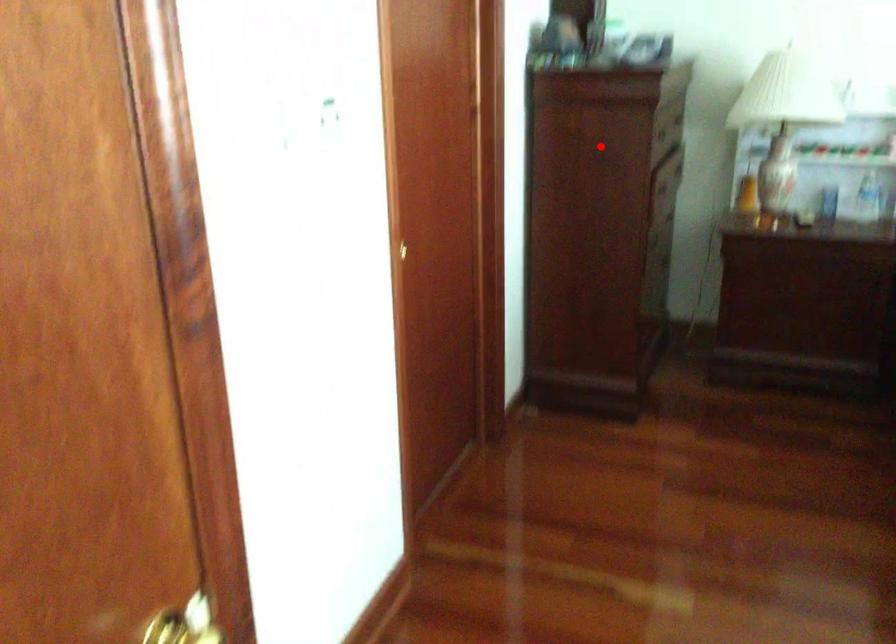
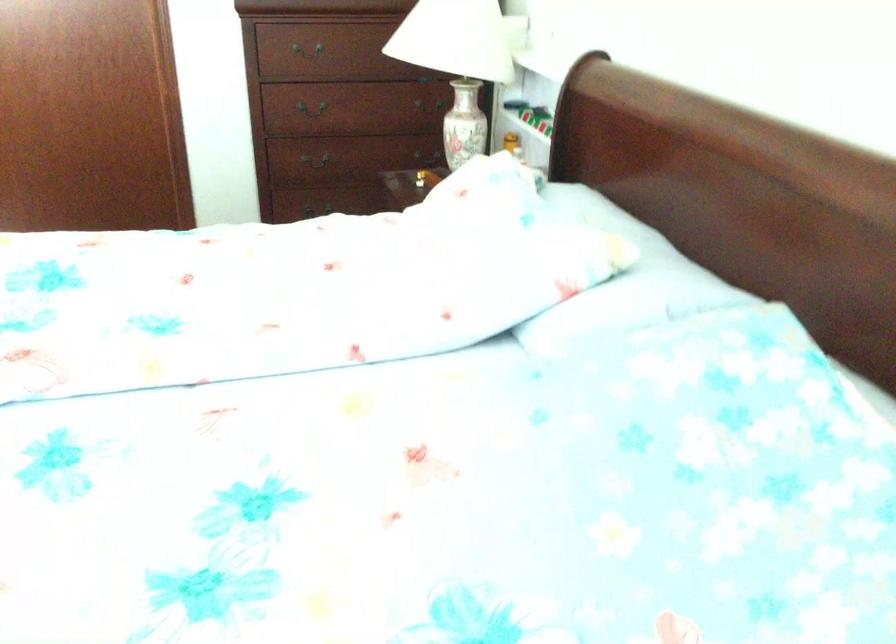
Question: I am providing you with two images of the same scene from different viewpoints. A red point is marked on the first image. At the location where the point appears in image 1, is it still visible in image 2?

Choices:
 (A) Yes
 (B) No

Answer: (A)